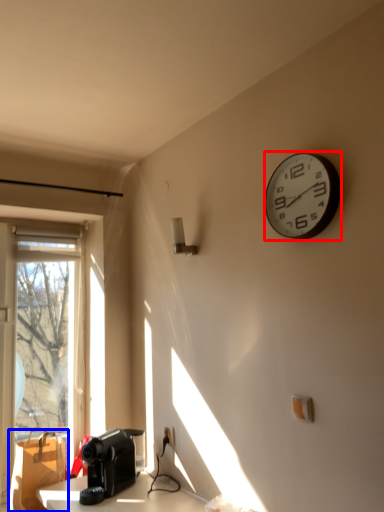
Question: Which of the following is the closest to the observer, wall clock (highlighted by a red box) or cardboard box (highlighted by a blue box)?

Choices:
 (A) wall clock
 (B) cardboard box

Answer: (A)